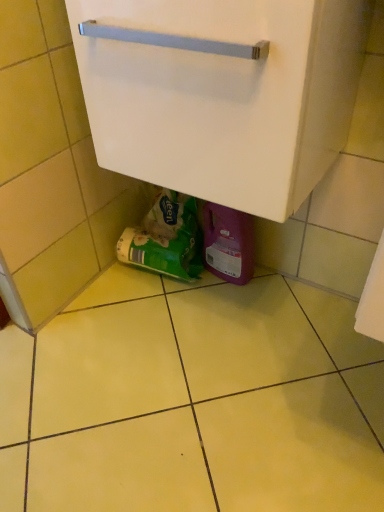
This screenshot has width=384, height=512. In order to click on green matte plastic bag at lower center in this screenshot , I will do `click(166, 238)`.

Measure the distance between point [175,205] and camera.

Point [175,205] is 1.20 meters away from camera.

What do you see at coordinates (166, 238) in the screenshot? Image resolution: width=384 pixels, height=512 pixels. I see `green matte plastic bag at lower center` at bounding box center [166, 238].

The height and width of the screenshot is (512, 384). What do you see at coordinates (224, 96) in the screenshot?
I see `white matte cabinet at center` at bounding box center [224, 96].

Find the location of a particular element. white matte cabinet at center is located at coordinates (224, 96).

Measure the distance between white matte cabinet at center and camera.

white matte cabinet at center is 48.06 centimeters from camera.

Locate an element on the screen. Image resolution: width=384 pixels, height=512 pixels. green matte plastic bag at lower center is located at coordinates (166, 238).

Is white matte cabinet at center to the right of green matte plastic bag at lower center from the viewer's perspective?

Yes.

Which object is further away from the camera taking this photo, white matte cabinet at center or green matte plastic bag at lower center?

green matte plastic bag at lower center is further away from the camera.

Is point (225, 83) positioned after point (158, 228)?

That is False.

From the image's perspective, is white matte cabinet at center positioned above or below green matte plastic bag at lower center?

Clearly, from the image's perspective, white matte cabinet at center is above green matte plastic bag at lower center.

From a real-world perspective, is white matte cabinet at center positioned over green matte plastic bag at lower center based on gravity?

Indeed, from a real-world perspective, white matte cabinet at center stands above green matte plastic bag at lower center.

Which of these two, white matte cabinet at center or green matte plastic bag at lower center, is thinner?

green matte plastic bag at lower center.

Can you confirm if white matte cabinet at center is taller than green matte plastic bag at lower center?

Correct, white matte cabinet at center is much taller as green matte plastic bag at lower center.

Is white matte cabinet at center bigger than green matte plastic bag at lower center?

Indeed, white matte cabinet at center has a larger size compared to green matte plastic bag at lower center.

Can we say white matte cabinet at center lies outside green matte plastic bag at lower center?

That's correct, white matte cabinet at center is outside of green matte plastic bag at lower center.

Is the surface of white matte cabinet at center in direct contact with green matte plastic bag at lower center?

They are not placed beside each other.

From the picture: Could you tell me if white matte cabinet at center is facing green matte plastic bag at lower center?

No.

The width and height of the screenshot is (384, 512). In order to click on garbage behind the white matte cabinet at center in this screenshot , I will do `click(166, 238)`.

In the image, is green matte plastic bag at lower center on the left side or the right side of white matte cabinet at center?

green matte plastic bag at lower center is positioned on white matte cabinet at center's left side.

Which object is further away from the camera, green matte plastic bag at lower center or white matte cabinet at center?

green matte plastic bag at lower center is more distant.

Is point (183, 211) more distant than point (279, 136)?

Yes, point (183, 211) is farther from viewer.

From the image's perspective, does green matte plastic bag at lower center appear higher than white matte cabinet at center?

No, from the image's perspective, green matte plastic bag at lower center is not over white matte cabinet at center.

From a real-world perspective, is green matte plastic bag at lower center physically located above or below white matte cabinet at center?

green matte plastic bag at lower center is situated lower than white matte cabinet at center in the real world.

From the picture: Can you confirm if green matte plastic bag at lower center is wider than white matte cabinet at center?

No, green matte plastic bag at lower center is not wider than white matte cabinet at center.

In the scene shown: Considering the relative sizes of green matte plastic bag at lower center and white matte cabinet at center in the image provided, is green matte plastic bag at lower center taller than white matte cabinet at center?

In fact, green matte plastic bag at lower center may be shorter than white matte cabinet at center.

Is green matte plastic bag at lower center smaller than white matte cabinet at center?

Indeed, green matte plastic bag at lower center has a smaller size compared to white matte cabinet at center.

Would you say green matte plastic bag at lower center contains white matte cabinet at center?

No, white matte cabinet at center is not inside green matte plastic bag at lower center.

Can you see green matte plastic bag at lower center touching white matte cabinet at center?

No, green matte plastic bag at lower center is not beside white matte cabinet at center.

Could you tell me if green matte plastic bag at lower center is facing white matte cabinet at center?

No, green matte plastic bag at lower center does not turn towards white matte cabinet at center.

The image size is (384, 512). I want to click on garbage below the white matte cabinet at center (from a real-world perspective), so click(166, 238).

The height and width of the screenshot is (512, 384). Identify the location of garbage that is on the left side of white matte cabinet at center. (166, 238).

This screenshot has width=384, height=512. What are the coordinates of `garbage behind the white matte cabinet at center` in the screenshot? It's located at (166, 238).